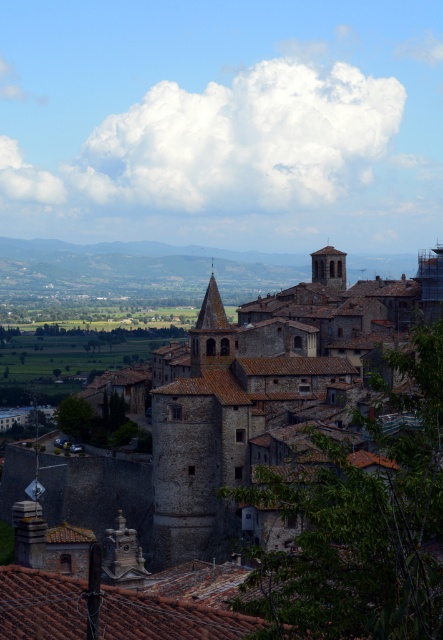
Question: Among these objects, which one is nearest to the camera?

Choices:
 (A) brown stone tower at center
 (B) smooth stone tower at upper right

Answer: (A)

Question: Is brown stone tower at center above smooth stone tower at upper right?

Choices:
 (A) yes
 (B) no

Answer: (B)

Question: Observing the image, what is the correct spatial positioning of brown stone tower at center in reference to smooth stone tower at upper right?

Choices:
 (A) below
 (B) above

Answer: (A)

Question: Which point is farther from the camera taking this photo?

Choices:
 (A) (280, 369)
 (B) (334, 252)

Answer: (B)

Question: Is brown stone tower at center further to camera compared to smooth stone tower at upper right?

Choices:
 (A) yes
 (B) no

Answer: (B)